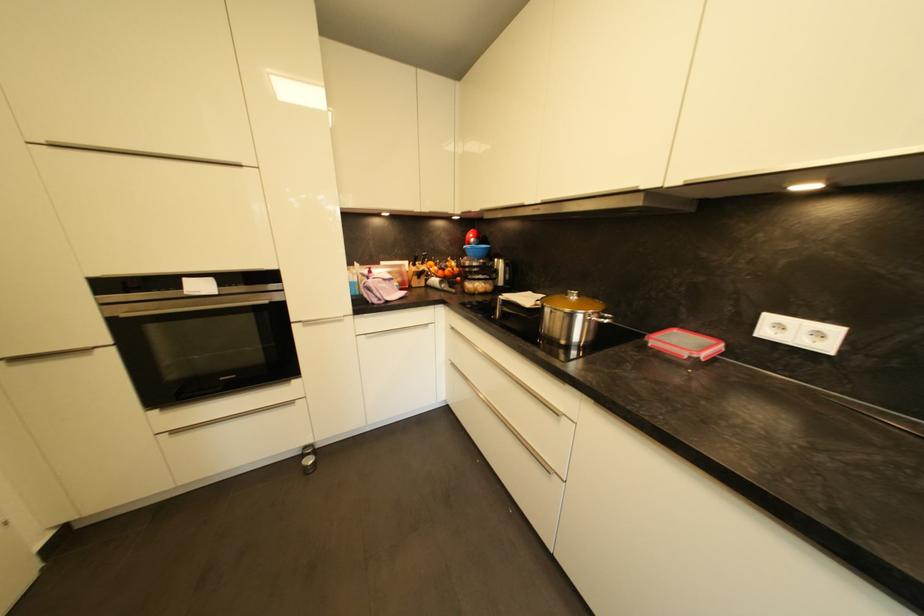
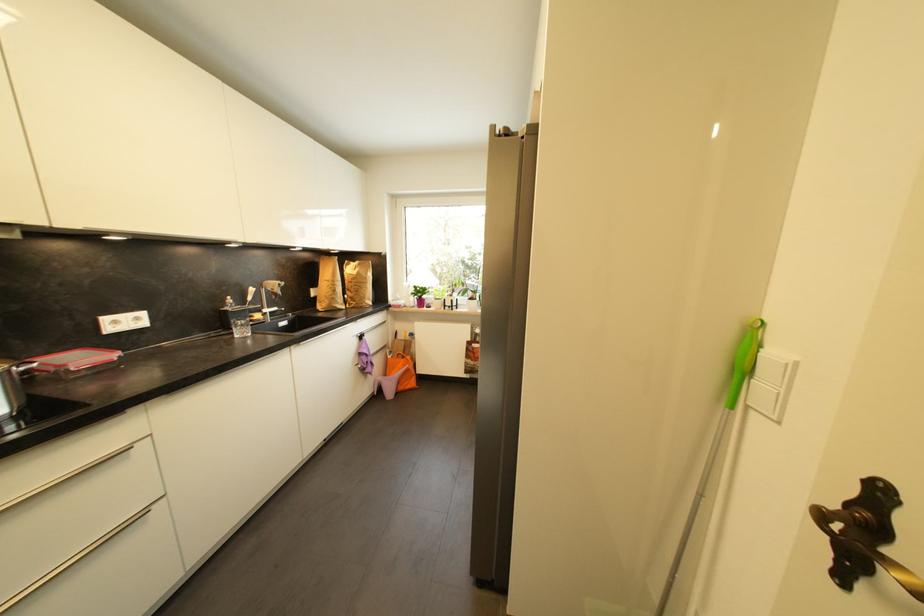
The point at (824, 336) is marked in the first image. Where is the corresponding point in the second image?

(142, 321)